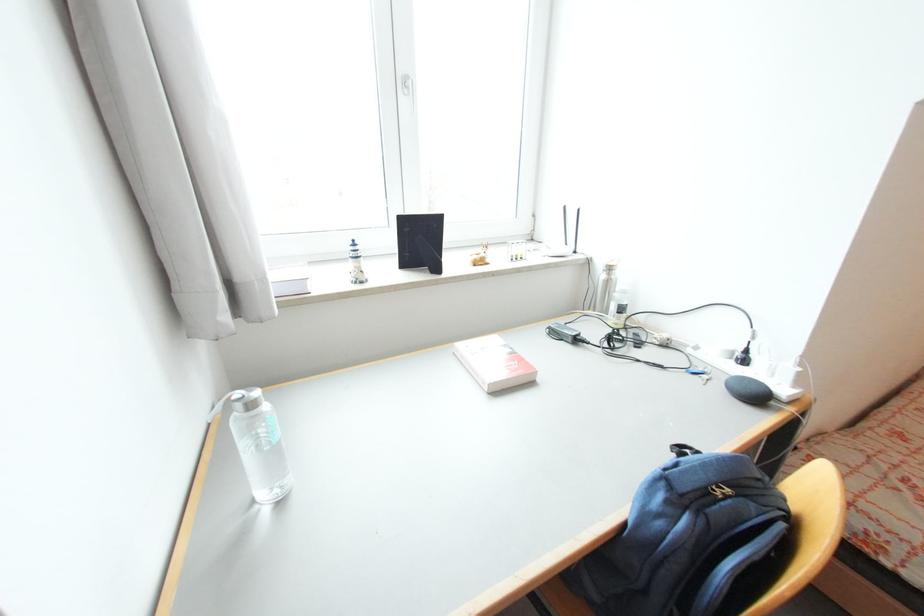
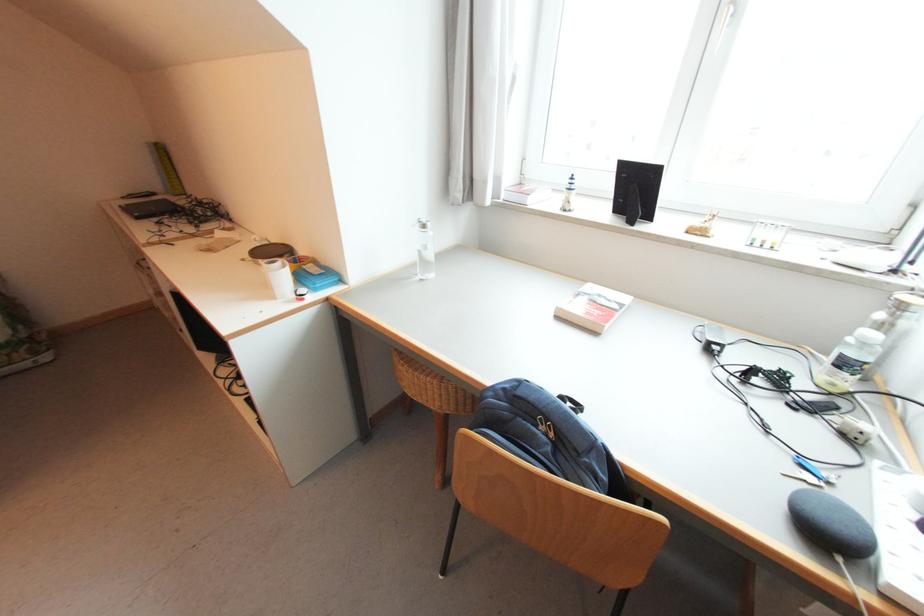
In the scene shown: The images are taken continuously from a first-person perspective. In which direction is your viewpoint rotating?

The camera's rotation is toward left-down.